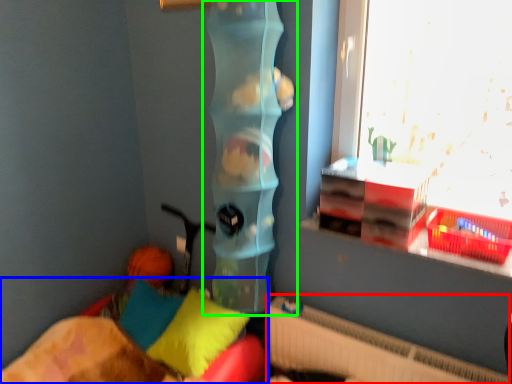
Question: Based on their relative distances, which object is nearer to radiator (highlighted by a red box)? Choose from furniture (highlighted by a blue box) and toy (highlighted by a green box).

Choices:
 (A) furniture
 (B) toy

Answer: (A)